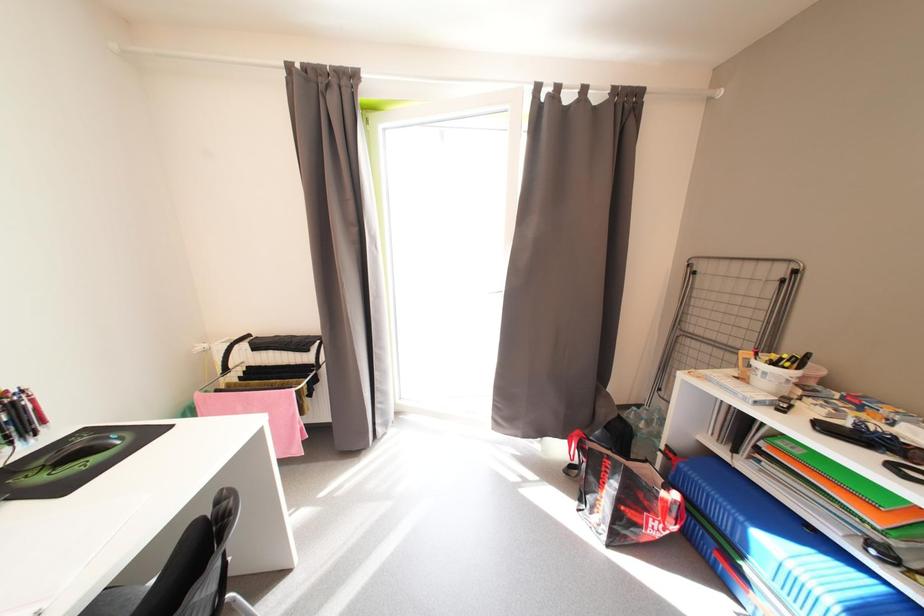
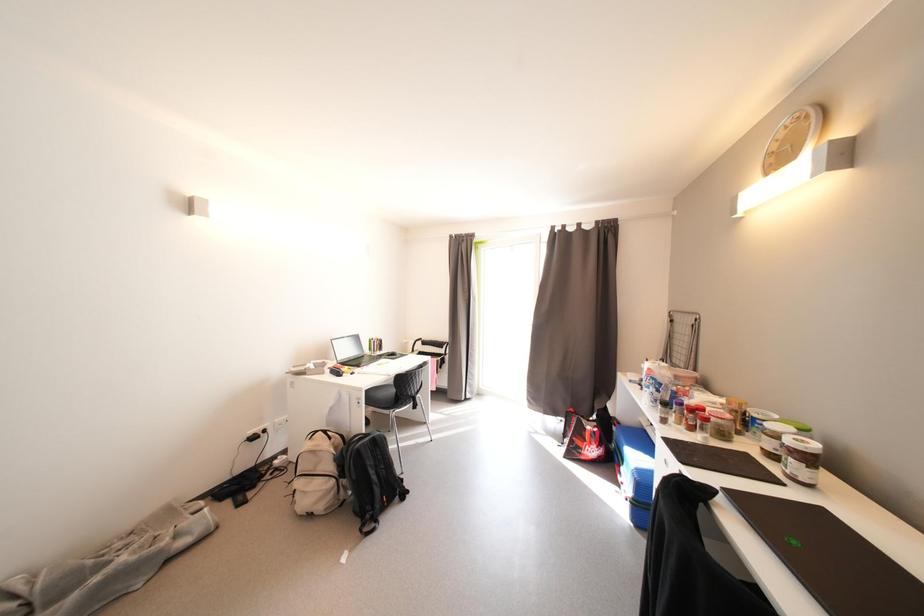
In a continuous first-person perspective shot, in which direction is the camera moving?

The cameraman walked toward right, backward.